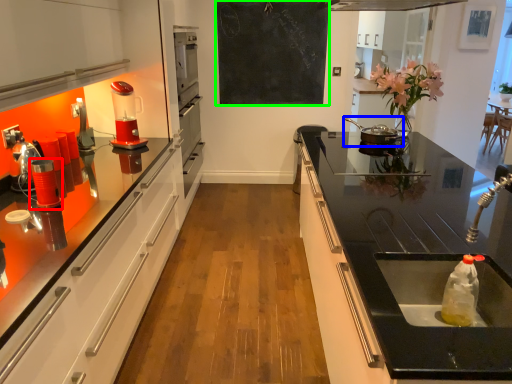
Question: Which object is the farthest from appliance (highlighted by a red box)? Choose among these: appliance (highlighted by a blue box) or bulletin board (highlighted by a green box).

Choices:
 (A) appliance
 (B) bulletin board

Answer: (B)